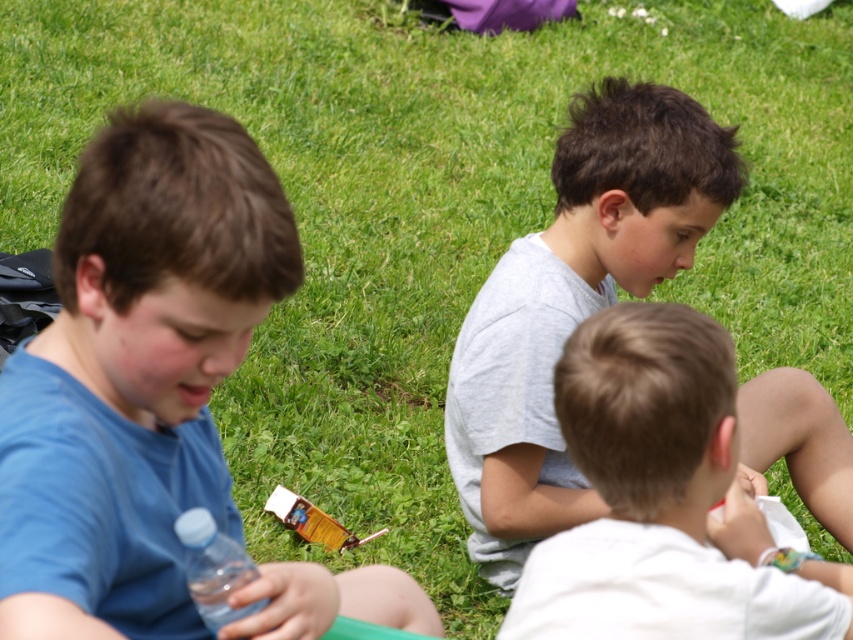
Question: Is gray cotton shirt at center positioned in front of white matte shirt at center?

Choices:
 (A) no
 (B) yes

Answer: (A)

Question: Which of the following is the closest to the observer?

Choices:
 (A) white matte shirt at center
 (B) transparent plastic bottle at lower left
 (C) blue matte shirt at left

Answer: (C)

Question: Which object is positioned closest to the gray cotton shirt at center?

Choices:
 (A) blue matte shirt at left
 (B) transparent plastic bottle at lower left
 (C) white matte shirt at center

Answer: (C)

Question: Which point is closer to the camera?

Choices:
 (A) (425, 605)
 (B) (189, 552)
 (C) (592, 502)
 (D) (737, 486)

Answer: (B)

Question: Can you confirm if white matte shirt at center is bigger than transparent plastic bottle at lower left?

Choices:
 (A) no
 (B) yes

Answer: (B)

Question: From the image, what is the correct spatial relationship of white matte shirt at center in relation to transparent plastic bottle at lower left?

Choices:
 (A) left
 (B) right

Answer: (B)